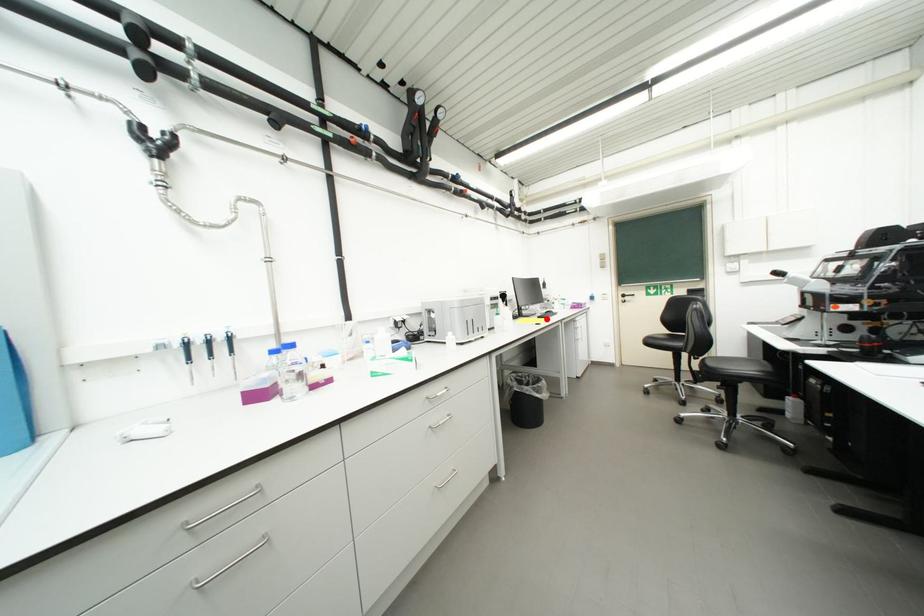
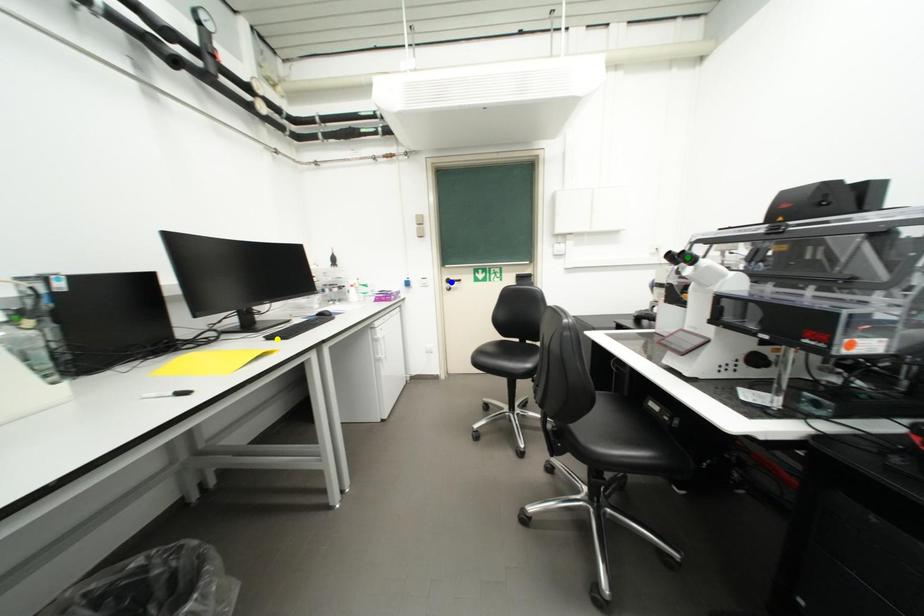
Question: I am providing you with two images of the same scene from different viewpoints. A red point is marked on the first image. You are given multiple points on the second image. Which mark in image 2 goes with the point in image 1?

Choices:
 (A) yellow point
 (B) green point
 (C) blue point

Answer: (A)